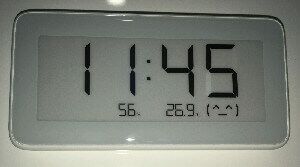
I want to click on digital clock, so click(63, 52).